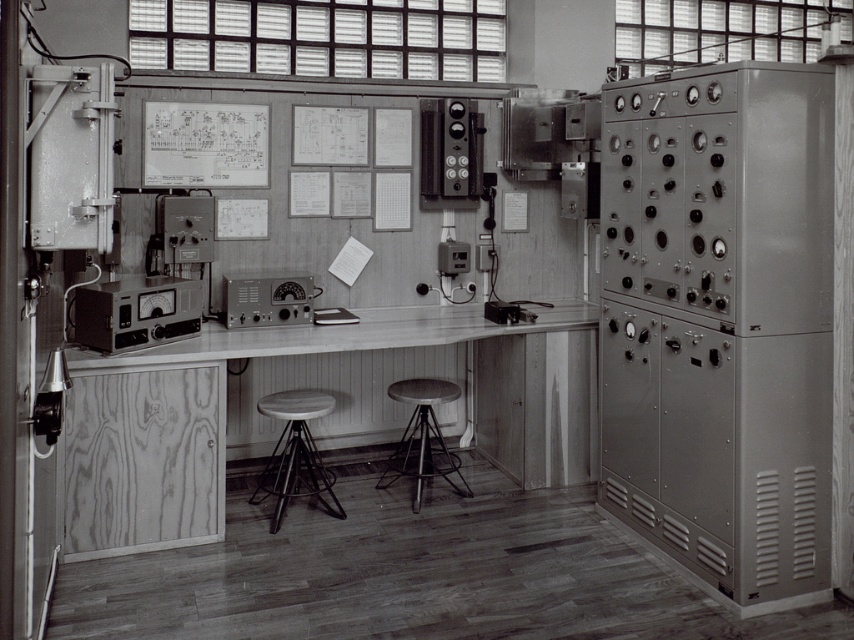
You are a technician in a control room who needs to adjust two devices. You have a tool that is 18 inches long. You need to reach both the metallic panel meter at center and the metallic silver radio at center. Can your tool comfortably reach both devices if you place it between them?

The metallic panel meter at center and metallic silver radio at center are 18.49 inches apart. Since the tool is 18 inches long, it may not comfortably reach both devices as the distance between them is slightly longer than the tool.

You are an engineer in this control room who needs to adjust a setting on the metallic panel meter at center. However, you notice another metallic panel at right nearby. Which one is positioned to the right side of the other?

The metallic panel at right is positioned to the right of the metallic panel meter at center.